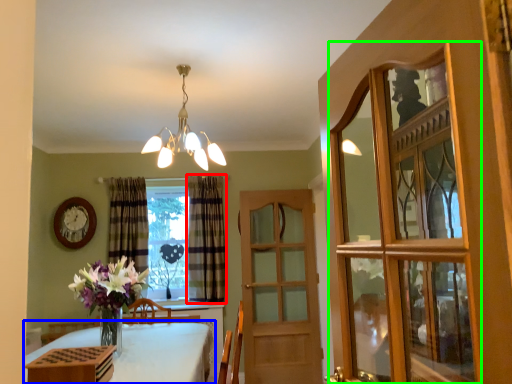
Question: Considering the real-world distances, which object is closest to curtain (highlighted by a red box)? table (highlighted by a blue box) or glass door (highlighted by a green box).

Choices:
 (A) table
 (B) glass door

Answer: (A)